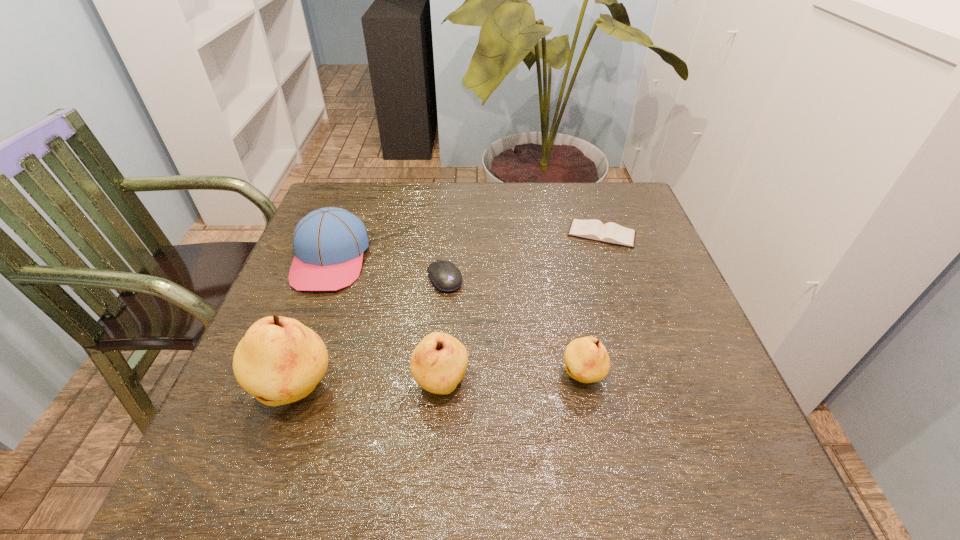
This screenshot has height=540, width=960. What are the coordinates of `free area in between the rightmost pear and the shortest object` in the screenshot? It's located at tap(592, 306).

Identify the location of blank region between the second tallest pear and the rightmost pear. The height and width of the screenshot is (540, 960). (512, 380).

The image size is (960, 540). I want to click on free area in between the diary and the second shortest object, so click(x=523, y=256).

I want to click on free spot between the second tallest pear and the baseball cap, so click(386, 322).

This screenshot has width=960, height=540. I want to click on free space between the shortest pear and the shortest object, so pyautogui.click(x=592, y=306).

You are a GUI agent. You are given a task and a screenshot of the screen. Output one action in this format:
    pyautogui.click(x=<x>, y=<y>)
    Task: Click on the empty location between the baseball cap and the leftmost pear
    The image size is (960, 540).
    Given the screenshot: What is the action you would take?
    pyautogui.click(x=314, y=326)

Choose which object is the third nearest neighbor to the tallest object. Please provide its 2D coordinates. Your answer should be formatted as a tuple, i.e. [(x, y)], where the tuple contains the x and y coordinates of a point satisfying the conditions above.

[(445, 276)]

Locate which object is the third closest to the leftmost pear. Please provide its 2D coordinates. Your answer should be formatted as a tuple, i.e. [(x, y)], where the tuple contains the x and y coordinates of a point satisfying the conditions above.

[(445, 276)]

At what (x,y) coordinates should I click in order to perform the action: click on the closest pear to the tallest object. Please return your answer as a coordinate pair (x, y). The width and height of the screenshot is (960, 540). Looking at the image, I should click on (438, 363).

Identify which pear is the nearest to the fifth tallest object. Please provide its 2D coordinates. Your answer should be formatted as a tuple, i.e. [(x, y)], where the tuple contains the x and y coordinates of a point satisfying the conditions above.

[(438, 363)]